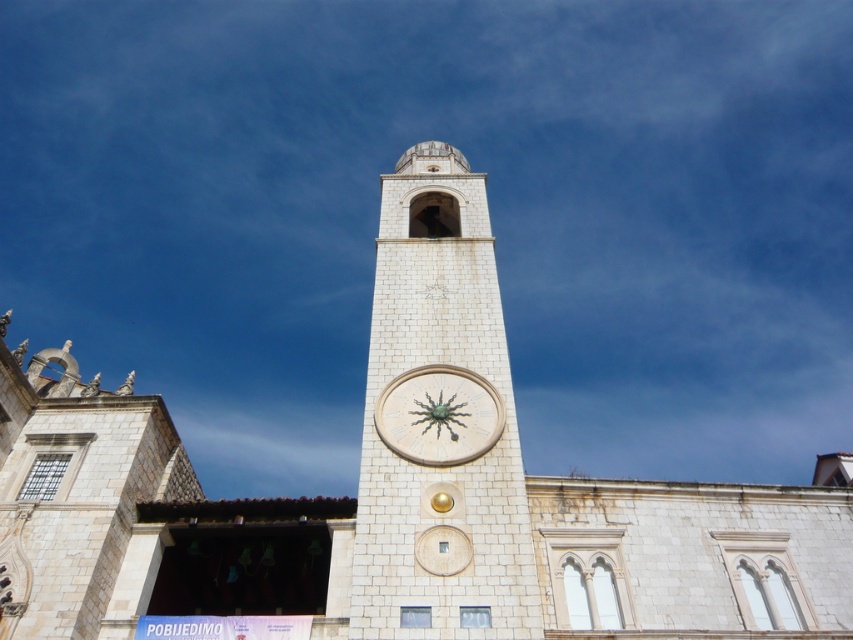
You are standing in a park and see the white stone clock tower at center. If you want to take a photo of it, where should you stand relative to the tower to capture it in the best possible view?

The best position to capture the white stone clock tower at center would be directly in front of it, ensuring the entire structure is framed well within the camera view.

You are an architect designing a miniature model of the scene. You need to ensure the white stone clock tower at center and the white stone clock at center are proportionally accurate. Which one should you make wider in your model?

The white stone clock tower at center should be made wider in the model since its width is larger than the white stone clock at center according to the description.